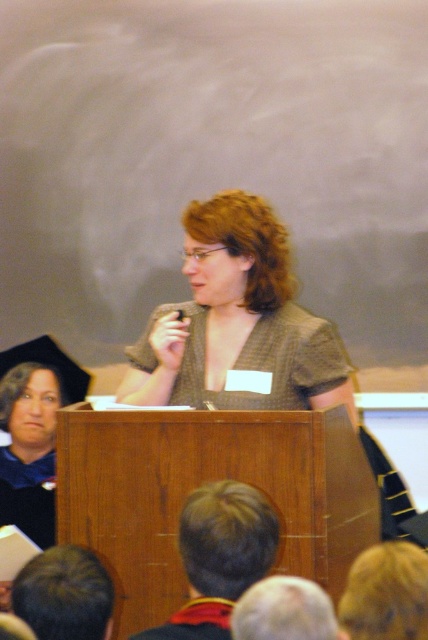
Question: Can you confirm if brown textured blouse at center is positioned to the right of matte black shirt at upper left?

Choices:
 (A) no
 (B) yes

Answer: (B)

Question: Is brown textured blouse at center wider than matte black shirt at upper left?

Choices:
 (A) yes
 (B) no

Answer: (A)

Question: Does brown textured blouse at center have a larger size compared to matte black shirt at upper left?

Choices:
 (A) no
 (B) yes

Answer: (B)